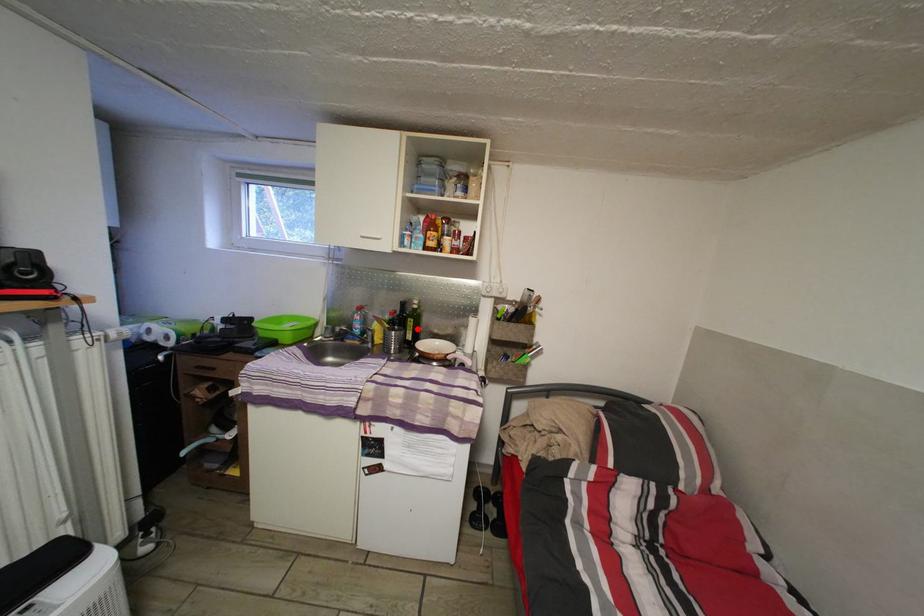
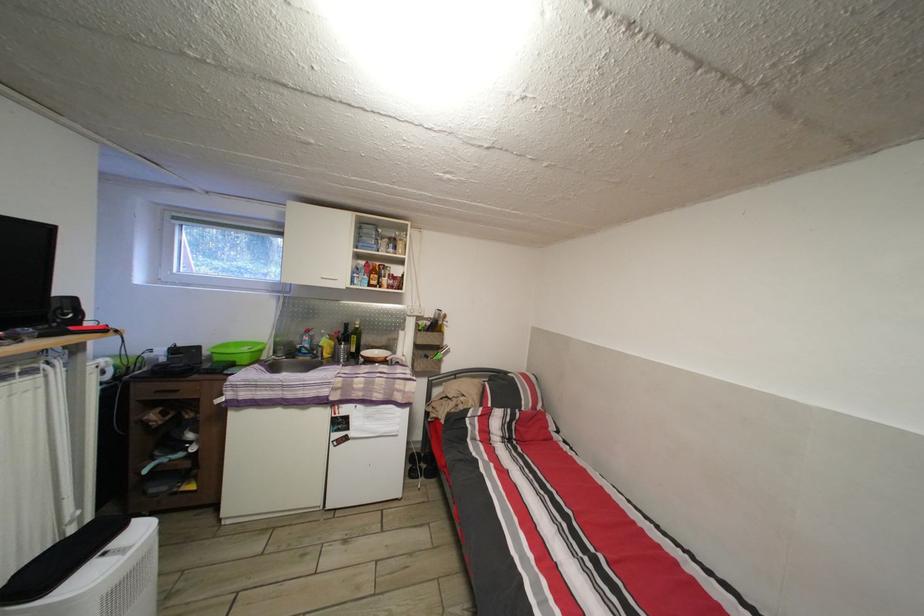
The point at the highlighted location is marked in the first image. Where is the corresponding point in the second image?

(360, 345)